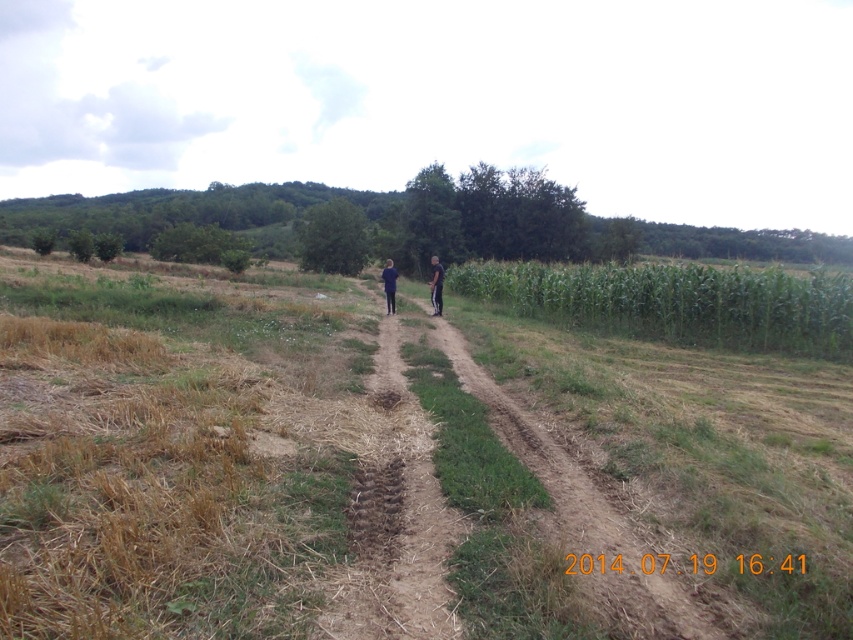
You are a hiker who wants to walk along the brown dirt trail at center. The blue fabric couple at center is blocking your path. Which direction should you move to reach the trail without disturbing them?

The brown dirt trail at center is to the right of the blue fabric couple at center, so you should move to the right to reach the trail without disturbing them.

From the picture: You are a hiker trying to cross the field. You have to choose between walking on the green grassy at center or the brown dirt trail at center. Which path will require you to bend down more due to the height of the vegetation?

A: The green grassy at center is much taller than the brown dirt trail at center, so you will have to bend down more when walking on the green grassy at center.

You are standing on the dirt path in the rural scene. You notice two points marked on the path. The first point is at coordinate point (438,636) and the second is at point (436,262). If you want to walk towards the background where the dense line of trees is, which point should you start walking from to reach the trees faster?

You should start walking from point (438,636) because it is closer to the camera, meaning it is further along the path towards the background where the dense line of trees is located. Starting from the closer point would allow you to reach the trees faster.